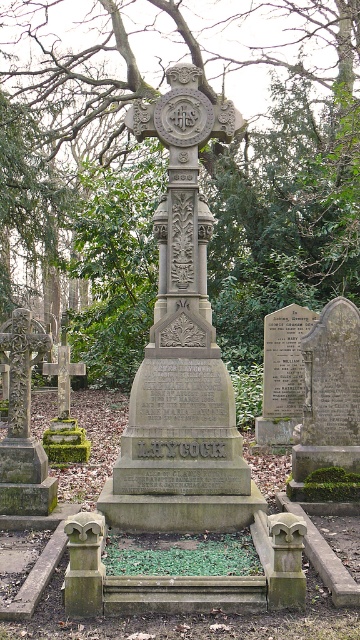
Question: Does green leafy tree at center have a lesser width compared to green mossy cross at left?

Choices:
 (A) yes
 (B) no

Answer: (B)

Question: Does green leafy tree at center appear on the right side of green mossy cross at left?

Choices:
 (A) yes
 (B) no

Answer: (A)

Question: Can you confirm if green leafy tree at center is positioned above green mossy cross at left?

Choices:
 (A) no
 (B) yes

Answer: (B)

Question: Which point appears farthest from the camera in this image?

Choices:
 (A) (38, 218)
 (B) (5, 340)
 (C) (186, 305)

Answer: (A)

Question: Which of the following is the closest to the observer?

Choices:
 (A) (122, 305)
 (B) (28, 458)

Answer: (B)

Question: Which object is farther from the camera taking this photo?

Choices:
 (A) gray stone cross at center
 (B) green mossy cross at left

Answer: (B)